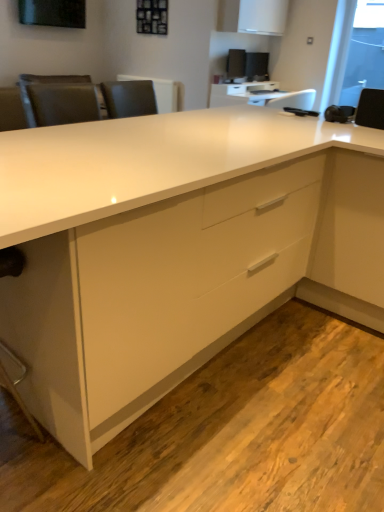
Image resolution: width=384 pixels, height=512 pixels. Find the location of `vacant space situated above white glossy desk at center (from a real-world perspective)`. vacant space situated above white glossy desk at center (from a real-world perspective) is located at coordinates (148, 131).